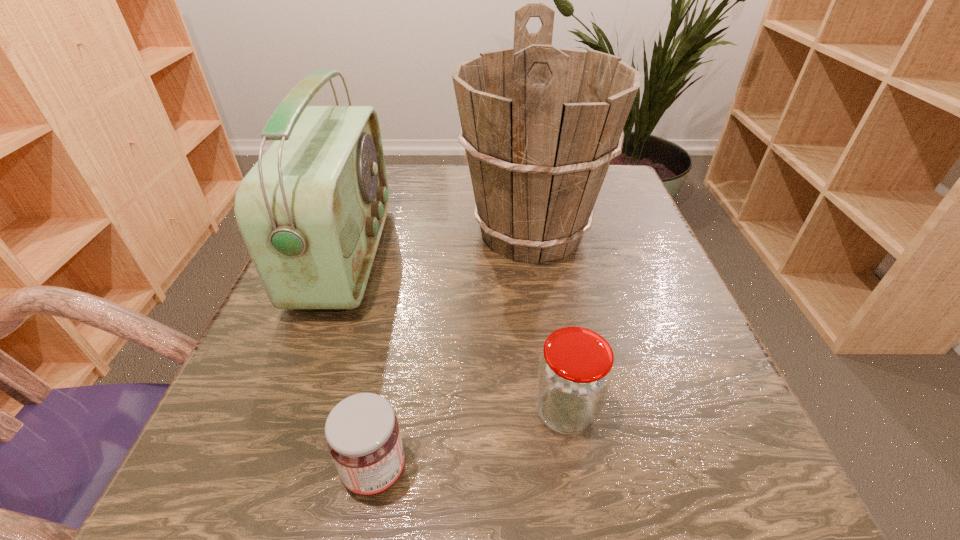
Identify the location of free space in the image that satisfies the following two spatial constraints: 1. on the front panel of the leftmost object; 2. on the back side of the second object from left to right. (265, 471).

The height and width of the screenshot is (540, 960). I want to click on vacant space that satisfies the following two spatial constraints: 1. on the front panel of the second tallest object; 2. on the right side of the jam, so 265,471.